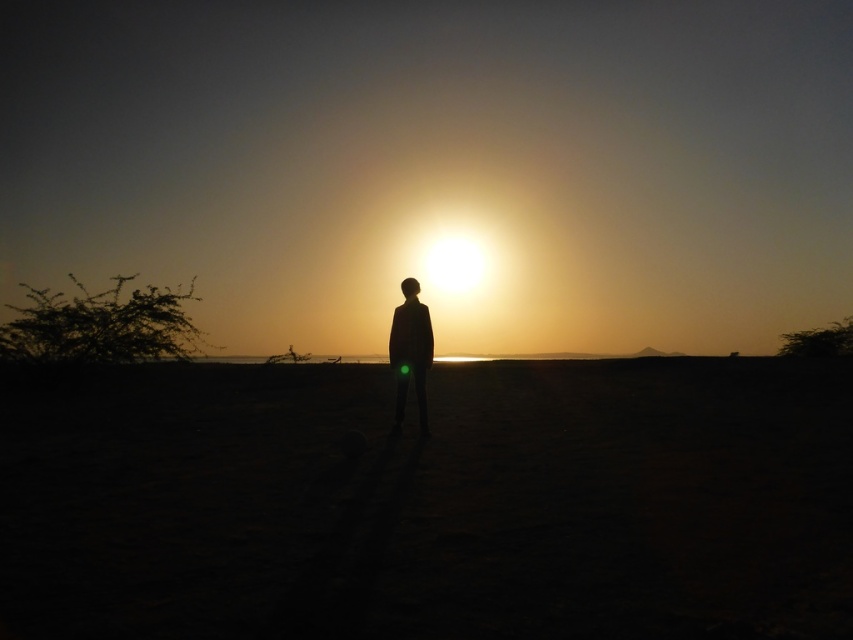
Is sandy at center taller than silhouette figure at center?

In fact, sandy at center may be shorter than silhouette figure at center.

Based on the photo, is sandy at center smaller than silhouette figure at center?

No.

Which is in front, point (730, 452) or point (401, 337)?

Point (730, 452)

You are a GUI agent. You are given a task and a screenshot of the screen. Output one action in this format:
    pyautogui.click(x=<x>, y=<y>)
    Task: Click on the sandy at center
    
    Given the screenshot: What is the action you would take?
    pyautogui.click(x=430, y=502)